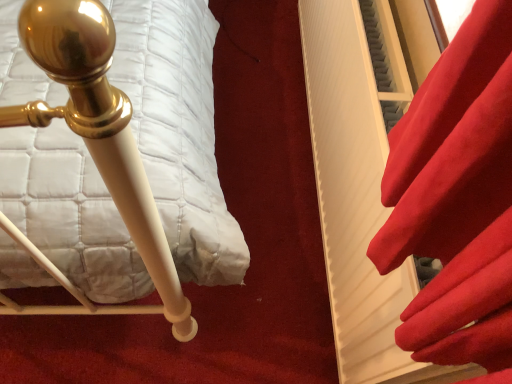
Question: From a real-world perspective, is matte white bedpost at left located beneath satin red curtain at right?

Choices:
 (A) yes
 (B) no

Answer: (A)

Question: Is matte white bedpost at left surrounding satin red curtain at right?

Choices:
 (A) no
 (B) yes

Answer: (A)

Question: Is matte white bedpost at left positioned behind satin red curtain at right?

Choices:
 (A) no
 (B) yes

Answer: (B)

Question: Is matte white bedpost at left next to satin red curtain at right?

Choices:
 (A) yes
 (B) no

Answer: (B)

Question: Is matte white bedpost at left wider than satin red curtain at right?

Choices:
 (A) no
 (B) yes

Answer: (B)

Question: Can you confirm if matte white bedpost at left is smaller than satin red curtain at right?

Choices:
 (A) yes
 (B) no

Answer: (B)

Question: Does satin red curtain at right have a smaller size compared to matte white bedpost at left?

Choices:
 (A) yes
 (B) no

Answer: (A)

Question: Considering the relative sizes of satin red curtain at right and matte white bedpost at left in the image provided, is satin red curtain at right wider than matte white bedpost at left?

Choices:
 (A) no
 (B) yes

Answer: (A)

Question: Can you confirm if satin red curtain at right is shorter than matte white bedpost at left?

Choices:
 (A) no
 (B) yes

Answer: (A)

Question: Considering the relative positions of satin red curtain at right and matte white bedpost at left in the image provided, is satin red curtain at right to the left of matte white bedpost at left from the viewer's perspective?

Choices:
 (A) yes
 (B) no

Answer: (B)

Question: From a real-world perspective, is satin red curtain at right physically above matte white bedpost at left?

Choices:
 (A) yes
 (B) no

Answer: (A)

Question: From a real-world perspective, is satin red curtain at right located beneath matte white bedpost at left?

Choices:
 (A) yes
 (B) no

Answer: (B)

Question: In terms of width, does satin red curtain at right look wider or thinner when compared to matte white bedpost at left?

Choices:
 (A) wide
 (B) thin

Answer: (B)